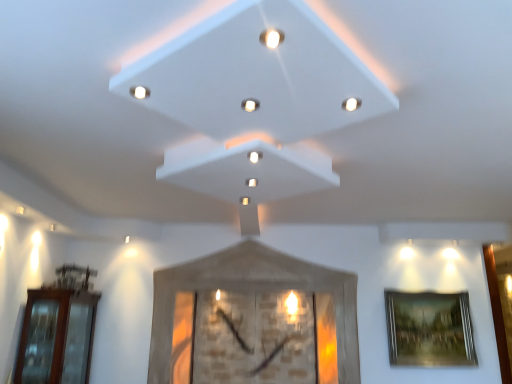
In order to face white glossy light at upper center, the fourth light positioned from the back, should I rotate leftwards or rightwards?

It's best to rotate left around 15.153 degrees.

You are a GUI agent. You are given a task and a screenshot of the screen. Output one action in this format:
    pyautogui.click(x=<x>, y=<y>)
    Task: Click on the white glossy light at center, the fourth light when ordered from front to back
    This screenshot has width=512, height=384.
    Given the screenshot: What is the action you would take?
    pyautogui.click(x=251, y=182)

What is the approximate height of white matte exhaust hood at center?

5.39 centimeters.

Image resolution: width=512 pixels, height=384 pixels. In order to click on brown glass door at left in this screenshot , I will do `click(56, 337)`.

Is white glossy light at center, the 3th light viewed from the left, facing away from matte white light at upper right, acting as the 2th light starting from the front?

That's not correct — white glossy light at center, the 3th light viewed from the left, is not looking away from matte white light at upper right, acting as the 2th light starting from the front.

Looking at this image, is white glossy light at center, acting as the 3th light starting from the top, spatially inside matte white light at upper right, the first light viewed from the right, or outside of it?

The correct answer is: outside.

Looking at this image, from the image's perspective, which object appears higher, white glossy light at center, positioned as the second light in back-to-front order, or matte white light at upper right, the fourth light viewed from the left?

matte white light at upper right, the fourth light viewed from the left, is shown above in the image.

Considering the sizes of objects white glossy light at center, acting as the 3th light starting from the top, and matte white light at upper right, which is the 3th light in bottom-to-top order, in the image provided, who is bigger, white glossy light at center, acting as the 3th light starting from the top, or matte white light at upper right, which is the 3th light in bottom-to-top order,?

matte white light at upper right, which is the 3th light in bottom-to-top order, is bigger.

Can you tell me how much white glossy light at upper center, which ranks as the 1th light in left-to-right order, and matte white light at upper right, which is the 3th light in bottom-to-top order, differ in facing direction?

The angle between the facing direction of white glossy light at upper center, which ranks as the 1th light in left-to-right order, and the facing direction of matte white light at upper right, which is the 3th light in bottom-to-top order, is 128 degrees.

Is the surface of white glossy light at upper center, the fourth light when ordered from right to left, in direct contact with matte white light at upper right, which is the 3th light in back-to-front order?

No, white glossy light at upper center, the fourth light when ordered from right to left, is not with matte white light at upper right, which is the 3th light in back-to-front order.

Relative to matte white light at upper right, positioned as the second light in top-to-bottom order, is white glossy light at upper center, which is the fourth light from bottom to top, in front or behind?

Visually, white glossy light at upper center, which is the fourth light from bottom to top, is located in front of matte white light at upper right, positioned as the second light in top-to-bottom order.

From the image's perspective, is white glossy light at upper center, the fourth light when ordered from right to left, over matte white light at upper right, the fourth light viewed from the left?

Yes, from the image's perspective, white glossy light at upper center, the fourth light when ordered from right to left, is on top of matte white light at upper right, the fourth light viewed from the left.

Which is more to the right, white matte exhaust hood at center or brown glass door at left?

white matte exhaust hood at center.

From the image's perspective, is white matte exhaust hood at center beneath brown glass door at left?

Incorrect, from the image's perspective, white matte exhaust hood at center is higher than brown glass door at left.

I want to click on glass door below the white matte exhaust hood at center (from a real-world perspective), so click(56, 337).

Looking at this image, considering the sizes of objects white matte exhaust hood at center and brown glass door at left in the image provided, who is bigger, white matte exhaust hood at center or brown glass door at left?

brown glass door at left is bigger.

Considering the sizes of white matte exhaust hood at center and white glossy light at center, the fourth light when ordered from front to back, in the image, is white matte exhaust hood at center wider or thinner than white glossy light at center, the fourth light when ordered from front to back,?

Clearly, white matte exhaust hood at center has more width compared to white glossy light at center, the fourth light when ordered from front to back.

Who is smaller, white matte exhaust hood at center or white glossy light at center, the first light positioned from the bottom?

Smaller between the two is white glossy light at center, the first light positioned from the bottom.

From a real-world perspective, who is located higher, white matte exhaust hood at center or white glossy light at center, the fourth light when ordered from front to back?

white matte exhaust hood at center.

Does white matte exhaust hood at center contain white glossy light at center, the fourth light when ordered from front to back?

Yes, white matte exhaust hood at center contains white glossy light at center, the fourth light when ordered from front to back.

Locate an element on the screen. The height and width of the screenshot is (384, 512). picture frame behind the matte white light at upper right, the first light viewed from the right is located at coordinates click(429, 329).

From the image's perspective, which one is positioned lower, gold-framed painting at right or matte white light at upper right, the first light viewed from the right?

From the image's view, gold-framed painting at right is below.

Would you say gold-framed painting at right is to the left or to the right of matte white light at upper right, acting as the 2th light starting from the front, in the picture?

gold-framed painting at right is positioned on matte white light at upper right, acting as the 2th light starting from the front,'s right side.

Is gold-framed painting at right positioned with its back to matte white light at upper right, the first light viewed from the right?

gold-framed painting at right is not turned away from matte white light at upper right, the first light viewed from the right.

Which object is wider, white matte exhaust hood at center or matte white light at upper right, positioned as the second light in top-to-bottom order?

white matte exhaust hood at center is wider.

From a real-world perspective, is white matte exhaust hood at center physically located above or below matte white light at upper right, which is the 3th light in back-to-front order?

In terms of real-world spatial position, white matte exhaust hood at center is below matte white light at upper right, which is the 3th light in back-to-front order.

From the image's perspective, is white matte exhaust hood at center below matte white light at upper right, acting as the 2th light starting from the front?

Yes.

Which of these two, white matte exhaust hood at center or matte white light at upper right, the first light viewed from the right, is bigger?

white matte exhaust hood at center.

Is matte white light at upper right, which is the 3th light in back-to-front order, closer to camera compared to white glossy light at center, the first light positioned from the bottom?

Yes, matte white light at upper right, which is the 3th light in back-to-front order, is closer to the camera.

Considering the sizes of objects matte white light at upper right, positioned as the second light in top-to-bottom order, and white glossy light at center, which is counted as the 1th light, starting from the back, in the image provided, who is wider, matte white light at upper right, positioned as the second light in top-to-bottom order, or white glossy light at center, which is counted as the 1th light, starting from the back,?

matte white light at upper right, positioned as the second light in top-to-bottom order.

You are a GUI agent. You are given a task and a screenshot of the screen. Output one action in this format:
    pyautogui.click(x=<x>, y=<y>)
    Task: Click on the 2nd light counting from the left side of the matte white light at upper right, which is the 3th light in bottom-to-top order
    
    Given the screenshot: What is the action you would take?
    pyautogui.click(x=251, y=182)

Identify the location of light that is the 1st object located above the white glossy light at center, acting as the 3th light starting from the top (from the image's perspective). Image resolution: width=512 pixels, height=384 pixels. (351, 104).

Starting from the white glossy light at upper center, the fourth light when ordered from right to left, which light is the 3rd one to the right? Please provide its 2D coordinates.

[(351, 104)]

Looking at the image, which one is located further to white glossy light at upper center, the fourth light when ordered from right to left, white glossy light at center, the fourth light from the top, or matte white light at upper right, acting as the 2th light starting from the front?

white glossy light at center, the fourth light from the top.

From the image, which object appears to be farther from gold-framed painting at right, white matte exhaust hood at center or matte white light at upper right, the fourth light viewed from the left?

matte white light at upper right, the fourth light viewed from the left, lies further to gold-framed painting at right than the other object.

Estimate the real-world distances between objects in this image. Which object is further from matte white light at upper right, positioned as the second light in top-to-bottom order, white glossy light at center, the 3th light viewed from the left, or gold-framed painting at right?

The object further to matte white light at upper right, positioned as the second light in top-to-bottom order, is gold-framed painting at right.

Looking at this image, looking at the image, which one is located closer to white matte exhaust hood at center, gold-framed painting at right or white glossy light at center, which appears as the 2th light when ordered from the bottom?

white glossy light at center, which appears as the 2th light when ordered from the bottom.

From the image, which object appears to be farther from brown glass door at left, white glossy light at upper center, which ranks as the 1th light in left-to-right order, or white glossy light at center, the 3th light viewed from the front?

white glossy light at upper center, which ranks as the 1th light in left-to-right order.

Which object lies further to the anchor point white matte exhaust hood at center, white glossy light at center, the fourth light from the top, or white glossy light at upper center, which ranks as the 1th light in top-to-bottom order?

Based on the image, white glossy light at upper center, which ranks as the 1th light in top-to-bottom order, appears to be further to white matte exhaust hood at center.

From the image, which object appears to be farther from matte white light at upper right, which is the 3th light in bottom-to-top order, white matte exhaust hood at center or white glossy light at center, acting as the 3th light starting from the top?

white matte exhaust hood at center is further to matte white light at upper right, which is the 3th light in bottom-to-top order.

Considering their positions, is brown glass door at left positioned further to gold-framed painting at right than matte white light at upper right, the first light viewed from the right?

Among the two, brown glass door at left is located further to gold-framed painting at right.

Identify the location of exhaust hood located between matte white light at upper right, which is the 3th light in back-to-front order, and gold-framed painting at right in the depth direction. This screenshot has width=512, height=384. (247, 170).

This screenshot has height=384, width=512. In order to click on exhaust hood between brown glass door at left and gold-framed painting at right from left to right in this screenshot , I will do `click(247, 170)`.

Where is `exhaust hood situated between brown glass door at left and white glossy light at center, which appears as the 2th light when ordered from the bottom, from left to right`? Image resolution: width=512 pixels, height=384 pixels. exhaust hood situated between brown glass door at left and white glossy light at center, which appears as the 2th light when ordered from the bottom, from left to right is located at coordinates (247, 170).

I want to click on light between white matte exhaust hood at center and white glossy light at center, which is counted as the 1th light, starting from the back, from front to back, so pos(254,156).